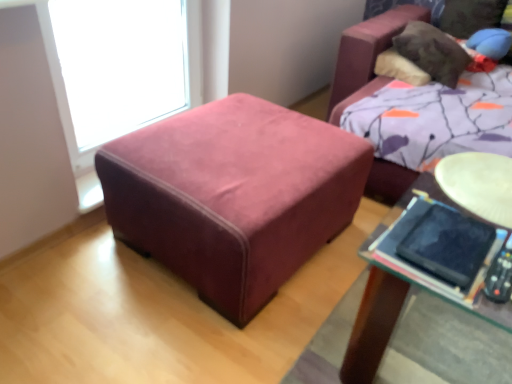
Locate an element on the screen. The height and width of the screenshot is (384, 512). free space above black matte tablet at lower right (from a real-world perspective) is located at coordinates (436, 230).